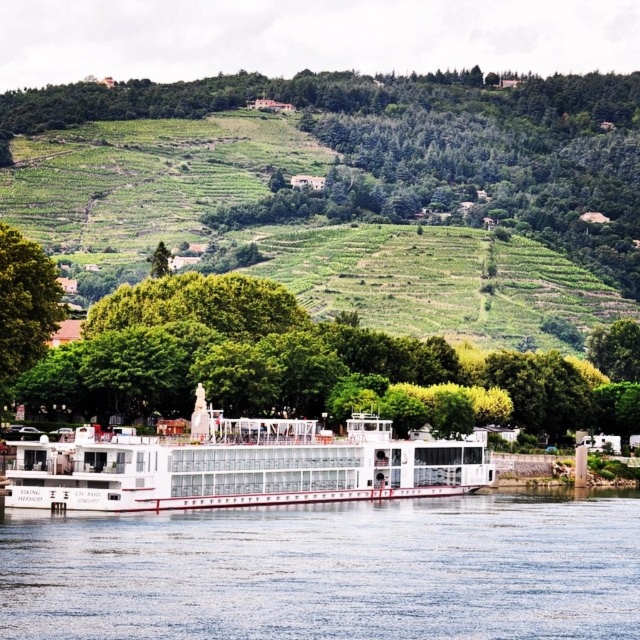
Question: Which object is positioned closest to the green leafy tree at center?

Choices:
 (A) green leafy tree at left
 (B) white glassy boat at center
 (C) blue glassy water at lower center

Answer: (B)

Question: Is blue glassy water at lower center below green leafy tree at left?

Choices:
 (A) yes
 (B) no

Answer: (A)

Question: Based on their relative distances, which object is nearer to the blue glassy water at lower center?

Choices:
 (A) white glassy boat at center
 (B) green leafy tree at center
 (C) green leafy tree at left

Answer: (A)

Question: In this image, where is green leafy tree at center located relative to green leafy tree at left?

Choices:
 (A) right
 (B) left

Answer: (A)

Question: Which point is closer to the camera?

Choices:
 (A) (225, 353)
 (B) (237, 442)

Answer: (B)

Question: Is green leafy tree at center smaller than white glassy boat at center?

Choices:
 (A) no
 (B) yes

Answer: (A)